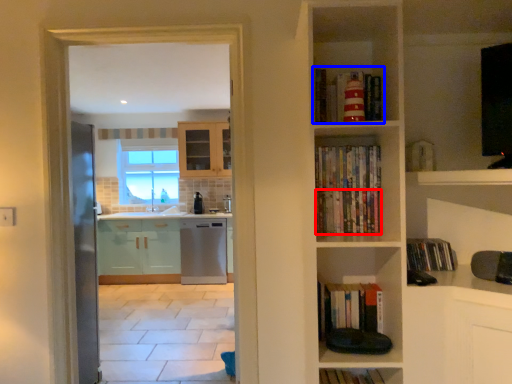
Question: Which object is closer to the camera taking this photo, book (highlighted by a red box) or book (highlighted by a blue box)?

Choices:
 (A) book
 (B) book

Answer: (B)